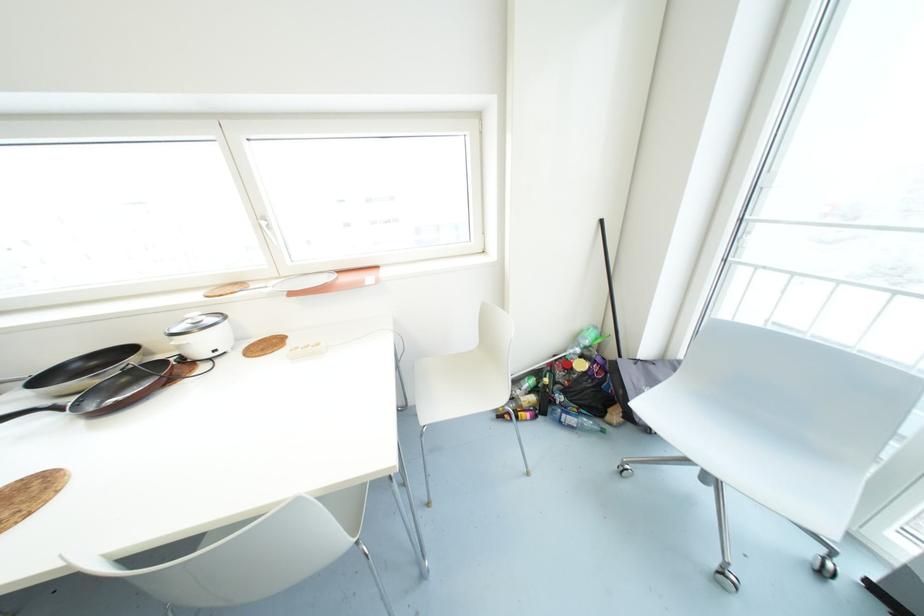
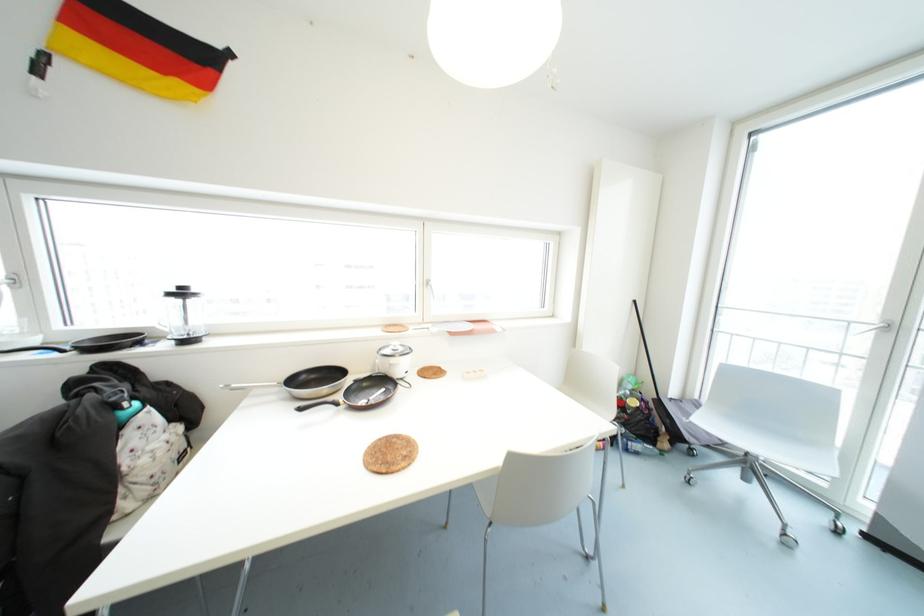
In the second image, find the point that corresponds to point (601, 221) in the first image.

(634, 301)